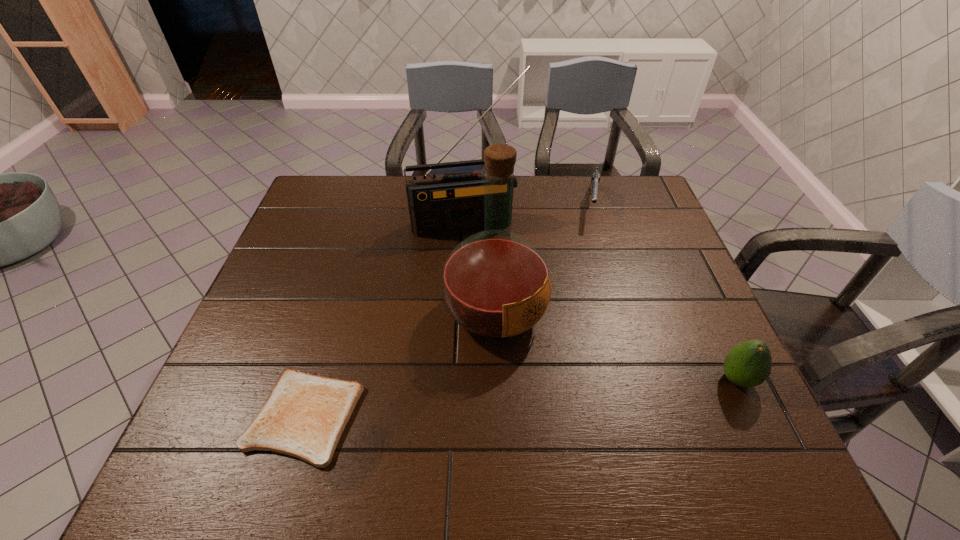
Where is `gun situated at the far edge`? gun situated at the far edge is located at coordinates pyautogui.click(x=595, y=179).

The width and height of the screenshot is (960, 540). I want to click on toast that is at the near edge, so click(x=304, y=416).

Locate an element on the screen. avocado present at the near edge is located at coordinates tap(749, 364).

This screenshot has width=960, height=540. I want to click on object that is at the left edge, so click(x=304, y=416).

In order to click on object that is at the right edge in this screenshot , I will do `click(749, 364)`.

The width and height of the screenshot is (960, 540). I want to click on object positioned at the near left corner, so click(304, 416).

In order to click on object at the near right corner in this screenshot , I will do `click(749, 364)`.

Identify the location of blank space at the far edge. (562, 195).

This screenshot has width=960, height=540. In the image, there is a desktop. Identify the location of vacant space at the near edge. (659, 388).

You are a GUI agent. You are given a task and a screenshot of the screen. Output one action in this format:
    pyautogui.click(x=<x>, y=<y>)
    Task: Click on the vacant space at the left edge of the desktop
    
    Given the screenshot: What is the action you would take?
    pyautogui.click(x=286, y=312)